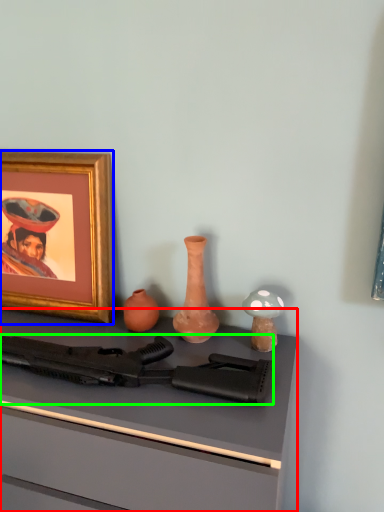
Question: Which is farther away from desk (highlighted by a red box)? picture frame (highlighted by a blue box) or rifle (highlighted by a green box)?

Choices:
 (A) picture frame
 (B) rifle

Answer: (A)